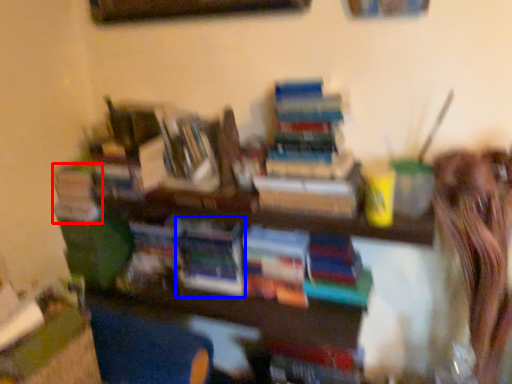
Question: Among these objects, which one is farthest to the camera, book (highlighted by a red box) or book (highlighted by a blue box)?

Choices:
 (A) book
 (B) book

Answer: (A)